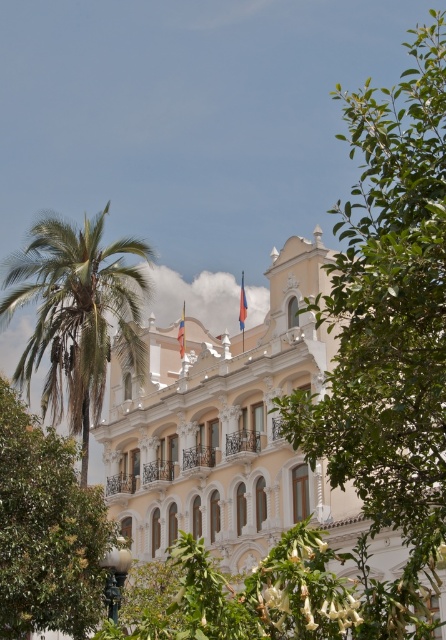
Question: Can you confirm if green leafy tree at upper right is positioned to the left of green leafy palm tree at left?

Choices:
 (A) no
 (B) yes

Answer: (A)

Question: Which object is closer to the camera taking this photo?

Choices:
 (A) orange fabric flag at upper center
 (B) green leafy tree at upper right
 (C) white ornate building at center

Answer: (B)

Question: Which object is farther from the camera taking this photo?

Choices:
 (A) green leafy palm tree at left
 (B) green leafy tree at upper right

Answer: (A)

Question: Is green leafy tree at upper right bigger than green leafy tree at center?

Choices:
 (A) yes
 (B) no

Answer: (A)

Question: Is the position of green leafy palm tree at left more distant than that of orange fabric flag at upper center?

Choices:
 (A) no
 (B) yes

Answer: (A)

Question: Which object is farther from the camera taking this photo?

Choices:
 (A) white ornate building at center
 (B) green leafy palm tree at left
 (C) red fabric flag at center
 (D) green leafy tree at center

Answer: (C)